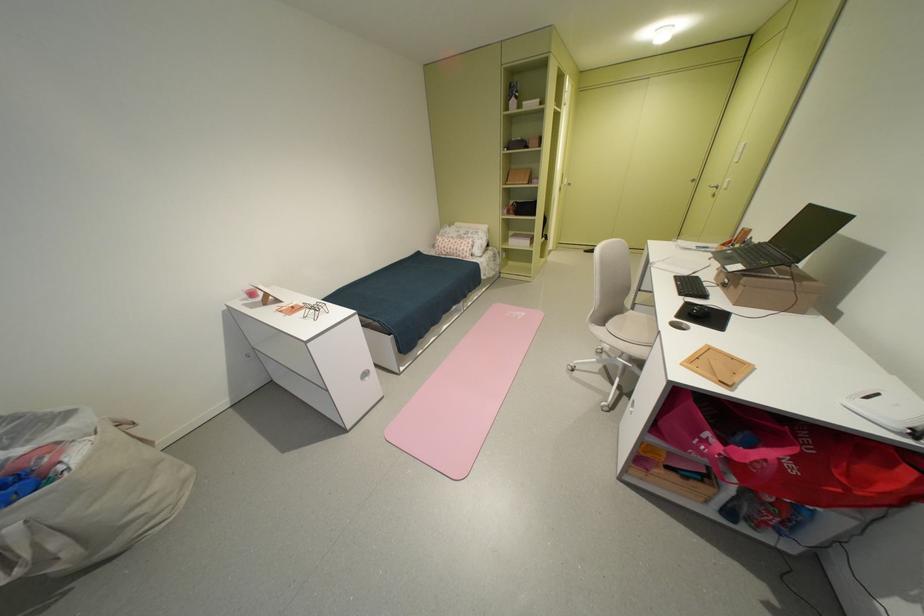
The width and height of the screenshot is (924, 616). In order to click on closet door handle in this screenshot , I will do `click(718, 187)`.